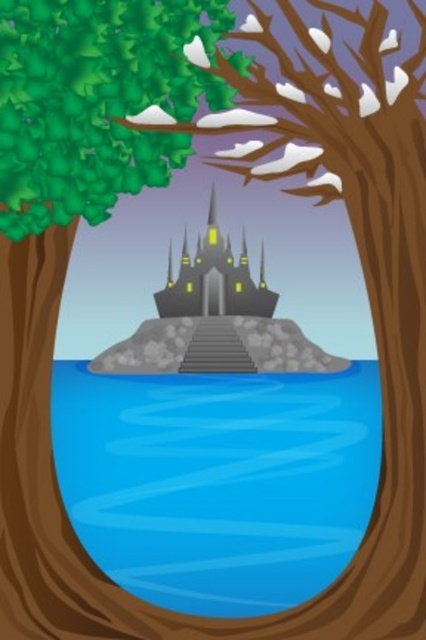
Question: Does blue water at center appear under dark gray stone castle at center?

Choices:
 (A) yes
 (B) no

Answer: (A)

Question: Considering the relative positions of blue water at center and dark gray stone castle at center in the image provided, where is blue water at center located with respect to dark gray stone castle at center?

Choices:
 (A) below
 (B) above

Answer: (A)

Question: Does blue water at center appear on the left side of dark gray stone castle at center?

Choices:
 (A) no
 (B) yes

Answer: (B)

Question: Among these objects, which one is farthest from the camera?

Choices:
 (A) dark gray stone castle at center
 (B) blue water at center

Answer: (A)